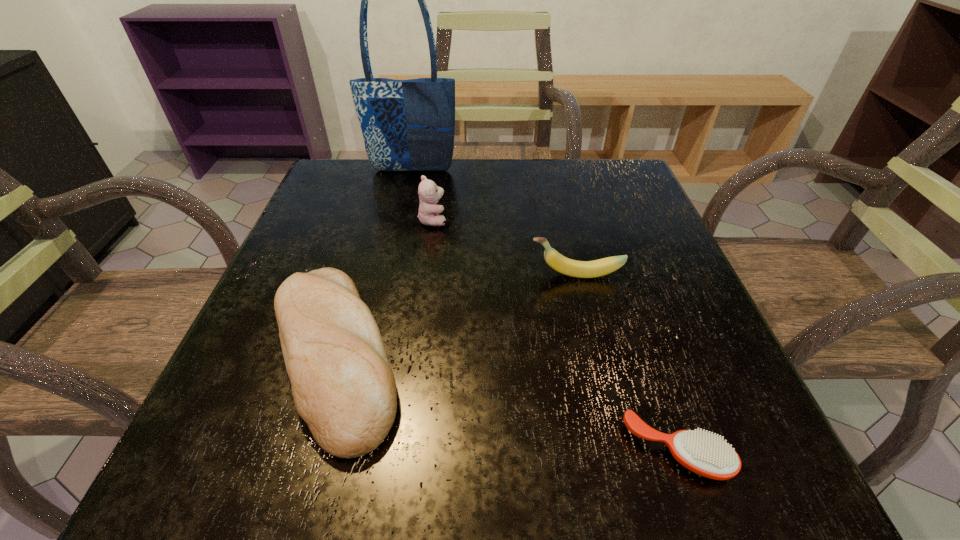
Where is `free location at the far right corner of the desktop`? This screenshot has height=540, width=960. free location at the far right corner of the desktop is located at coordinates (612, 209).

Where is `vacant area at the near right corner`? This screenshot has height=540, width=960. vacant area at the near right corner is located at coordinates (756, 484).

Identify the location of vacant space in between the hairbrush and the bread. The image size is (960, 540). (505, 403).

What are the coordinates of `blank region between the banana and the farthest object` in the screenshot? It's located at (494, 222).

At what (x,y) coordinates should I click in order to perform the action: click on vacant point located between the teddy bear and the banana. Please return your answer as a coordinate pair (x, y). This screenshot has width=960, height=540. Looking at the image, I should click on (504, 247).

What are the coordinates of `vacant space that is in between the banana and the hairbrush` in the screenshot? It's located at (626, 363).

The image size is (960, 540). Identify the location of vacant area between the banana and the shopping bag. (494, 222).

Identify the location of free area in between the bread and the banana. (454, 315).

I want to click on free area in between the bread and the tallest object, so click(x=372, y=262).

At what (x,y) coordinates should I click in order to perform the action: click on free space between the bread and the shopping bag. Please return your answer as a coordinate pair (x, y). Looking at the image, I should click on (372, 262).